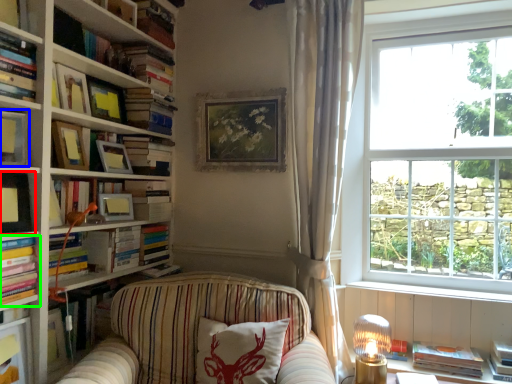
Question: Considering the real-world distances, which object is closest to book (highlighted by a red box)? book (highlighted by a blue box) or book (highlighted by a green box).

Choices:
 (A) book
 (B) book

Answer: (B)